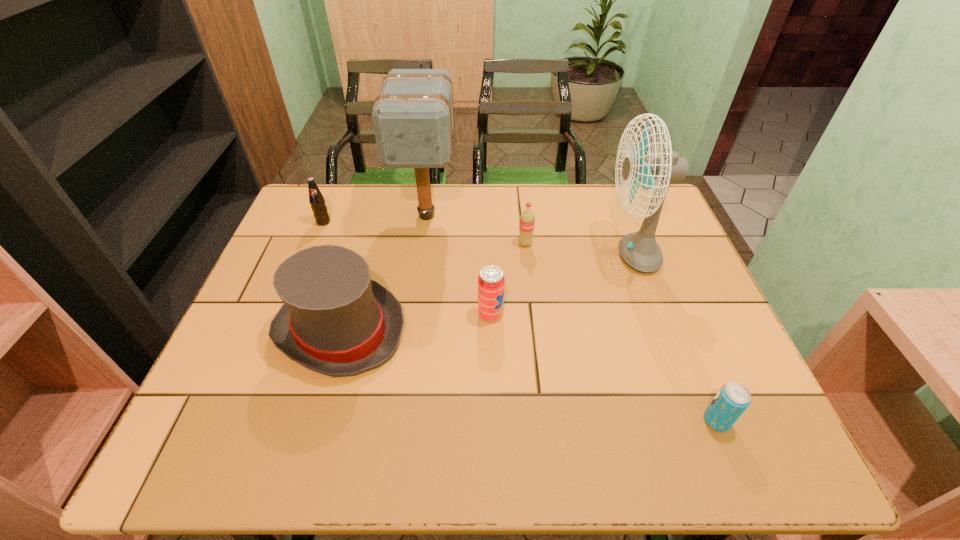
Locate an element on the screen. This screenshot has width=960, height=540. free spot between the mallet and the nearest object is located at coordinates (572, 318).

The width and height of the screenshot is (960, 540). In order to click on unoccupied position between the second nearest soda can and the dress hat in this screenshot , I will do `click(416, 322)`.

You are a GUI agent. You are given a task and a screenshot of the screen. Output one action in this format:
    pyautogui.click(x=<x>, y=<y>)
    Task: Click on the vacant region between the farthest soda can and the nearest soda can
    
    Given the screenshot: What is the action you would take?
    pyautogui.click(x=520, y=321)

Where is `empty space between the fan and the third object from right to left`? empty space between the fan and the third object from right to left is located at coordinates (578, 249).

Locate an element on the screen. The height and width of the screenshot is (540, 960). object that is the second closest to the third farthest soda can is located at coordinates (527, 218).

This screenshot has width=960, height=540. In order to click on object that is the sixth closest to the shortest soda can in this screenshot , I will do `click(316, 199)`.

The height and width of the screenshot is (540, 960). Find the location of `soda can that is the fourth closest to the mallet`. soda can that is the fourth closest to the mallet is located at coordinates (733, 398).

This screenshot has width=960, height=540. Find the location of `soda can that can be found as the closest to the fourth object from right to left`. soda can that can be found as the closest to the fourth object from right to left is located at coordinates (527, 218).

The width and height of the screenshot is (960, 540). Identify the location of vacant area that satisfies the following two spatial constraints: 1. on the striking surface of the mallet; 2. on the right side of the second soda can from right to left. (422, 244).

Find the location of a particular element. This screenshot has width=960, height=540. free spot that satisfies the following two spatial constraints: 1. on the back side of the dress hat; 2. on the right side of the third farthest soda can is located at coordinates (345, 314).